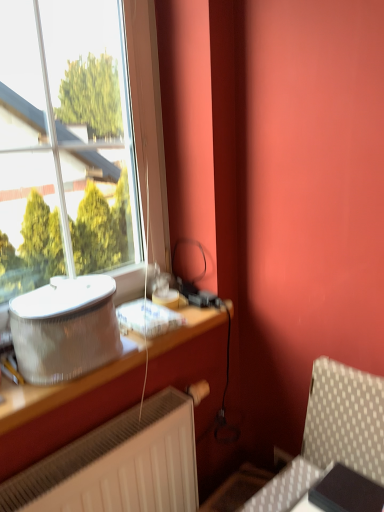
Question: Considering the relative sizes of metallic silver table at left and silver metallic speaker at left in the image provided, is metallic silver table at left thinner than silver metallic speaker at left?

Choices:
 (A) no
 (B) yes

Answer: (A)

Question: Is the position of metallic silver table at left more distant than that of silver metallic speaker at left?

Choices:
 (A) yes
 (B) no

Answer: (B)

Question: Is metallic silver table at left bigger than silver metallic speaker at left?

Choices:
 (A) yes
 (B) no

Answer: (A)

Question: Is metallic silver table at left positioned beyond the bounds of silver metallic speaker at left?

Choices:
 (A) yes
 (B) no

Answer: (A)

Question: Considering the relative sizes of metallic silver table at left and silver metallic speaker at left in the image provided, is metallic silver table at left wider than silver metallic speaker at left?

Choices:
 (A) no
 (B) yes

Answer: (B)

Question: Is metallic silver table at left oriented towards silver metallic speaker at left?

Choices:
 (A) yes
 (B) no

Answer: (B)

Question: From a real-world perspective, is silver metallic speaker at left over metallic silver table at left?

Choices:
 (A) no
 (B) yes

Answer: (B)

Question: Is silver metallic speaker at left positioned beyond the bounds of metallic silver table at left?

Choices:
 (A) no
 (B) yes

Answer: (B)

Question: Is silver metallic speaker at left at the right side of metallic silver table at left?

Choices:
 (A) yes
 (B) no

Answer: (B)

Question: From the image's perspective, would you say silver metallic speaker at left is shown under metallic silver table at left?

Choices:
 (A) no
 (B) yes

Answer: (A)

Question: Is silver metallic speaker at left bigger than metallic silver table at left?

Choices:
 (A) no
 (B) yes

Answer: (A)

Question: Is silver metallic speaker at left positioned behind metallic silver table at left?

Choices:
 (A) yes
 (B) no

Answer: (A)

Question: From a real-world perspective, relative to metallic silver table at left, is silver metallic speaker at left vertically above or below?

Choices:
 (A) below
 (B) above

Answer: (B)